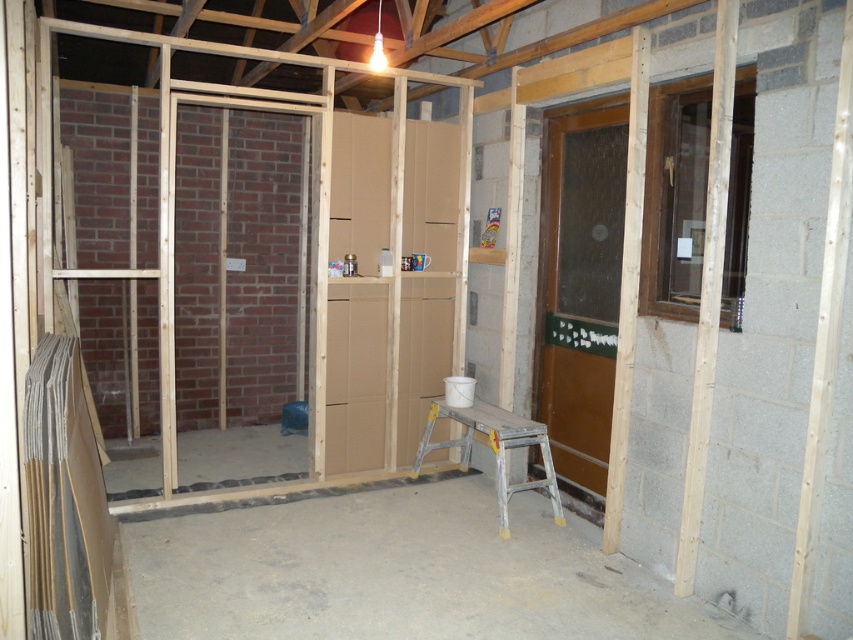
Question: Which point appears closest to the camera in this image?

Choices:
 (A) (712, 348)
 (B) (461, 413)
 (C) (613, 486)

Answer: (A)

Question: Among these objects, which one is nearest to the camera?

Choices:
 (A) silver metallic stool at center
 (B) smooth wood beam at right
 (C) light brown wood at right

Answer: (B)

Question: Where is smooth wood beam at right located in relation to light brown wood at right in the image?

Choices:
 (A) above
 (B) below

Answer: (B)

Question: Estimate the real-world distances between objects in this image. Which object is closer to the smooth wood beam at right?

Choices:
 (A) light brown wood at right
 (B) silver metallic stool at center

Answer: (A)

Question: Considering the relative positions of light brown wood at right and silver metallic stool at center in the image provided, where is light brown wood at right located with respect to silver metallic stool at center?

Choices:
 (A) below
 (B) above

Answer: (B)

Question: Does smooth wood beam at right appear over light brown wood at right?

Choices:
 (A) no
 (B) yes

Answer: (A)